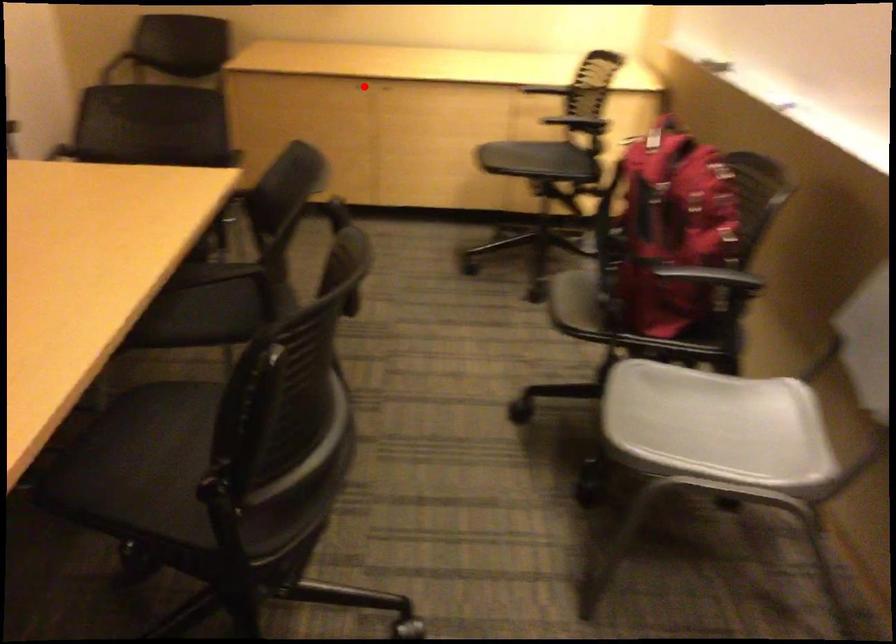
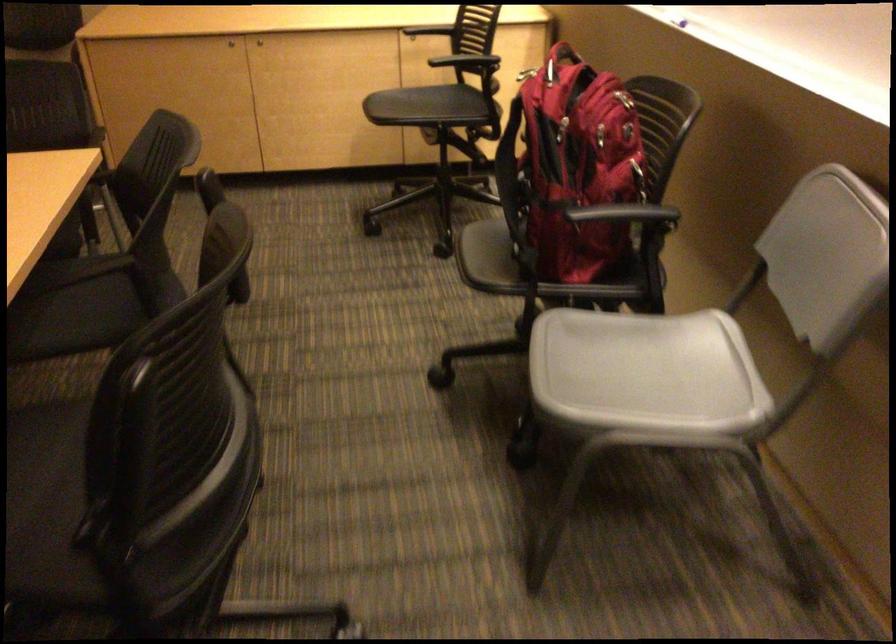
Where in the second image is the point corresponding to the highlighted location from the first image?

(230, 44)